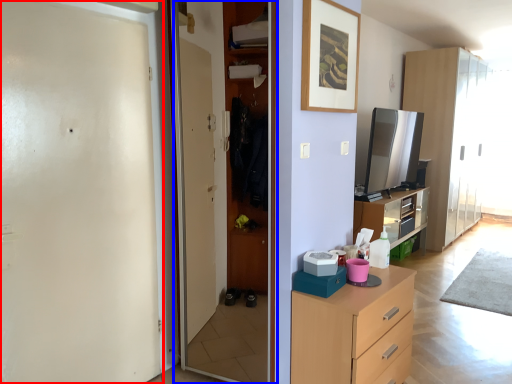
Question: Which object appears closest to the camera in this image, screen door (highlighted by a red box) or screen door (highlighted by a blue box)?

Choices:
 (A) screen door
 (B) screen door

Answer: (A)